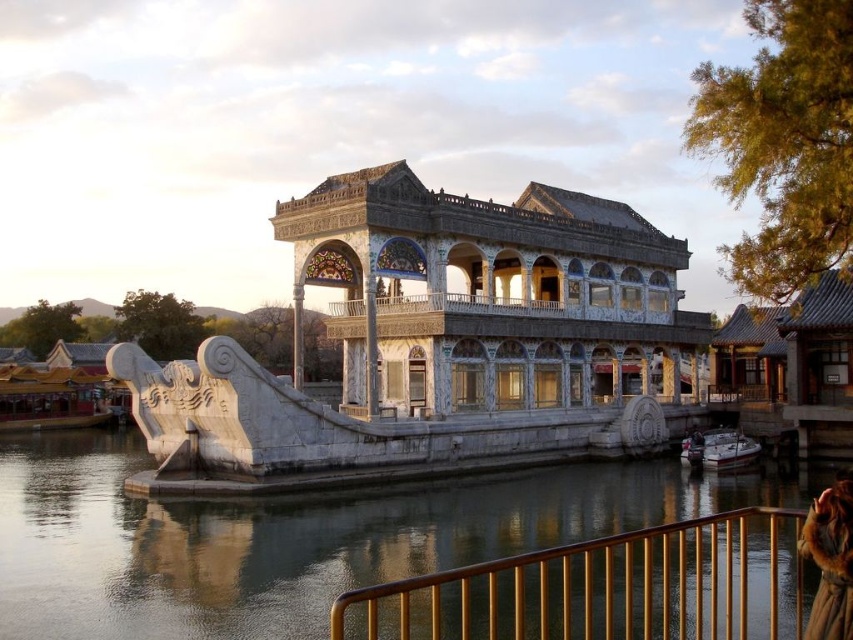
You are a visitor standing at the edge of the traditional Chinese pavilion. You notice the gold polished metal railing at lower center and the fuzzy brown fur coat at lower right. Which object is taller from your viewpoint?

The gold polished metal railing at lower center has a lesser height compared to the fuzzy brown fur coat at lower right, so the fuzzy brown fur coat at lower right is taller.

You are standing at the edge of the water near the pavilion and see both the fuzzy brown fur coat at lower right and the white glossy boat at lower right. Which object is closer to the left side of the scene?

The fuzzy brown fur coat at lower right is to the left of the white glossy boat at lower right, so it is closer to the left side of the scene.